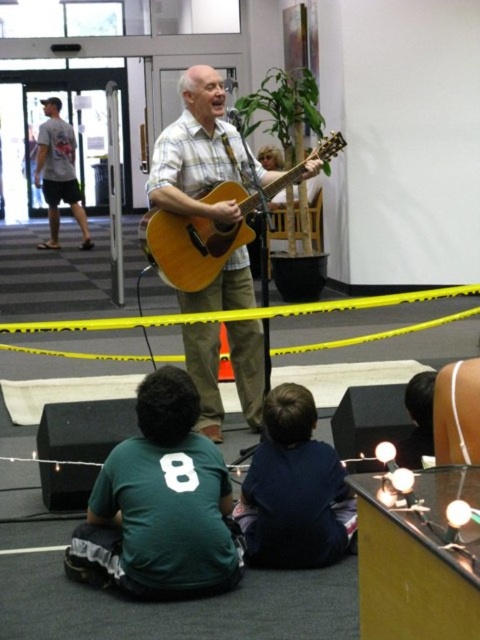
Is wooden acoustic guitar at center taller than dark blue shirt at lower center?

Yes.

Does wooden acoustic guitar at center lie in front of dark blue shirt at lower center?

No.

Does point (176, 129) come farther from viewer compared to point (286, 552)?

Yes, it is behind point (286, 552).

Find the location of a particular element. This screenshot has height=640, width=480. wooden acoustic guitar at center is located at coordinates (197, 150).

Can you confirm if green jersey at lower left is positioned to the left of wooden acoustic guitar at center?

Correct, you'll find green jersey at lower left to the left of wooden acoustic guitar at center.

What do you see at coordinates (159, 504) in the screenshot? I see `green jersey at lower left` at bounding box center [159, 504].

The height and width of the screenshot is (640, 480). I want to click on green jersey at lower left, so click(x=159, y=504).

Locate an element on the screen. This screenshot has width=480, height=640. green jersey at lower left is located at coordinates (159, 504).

Between wooden acoustic guitar at center and light brown acoustic guitar at center, which one has less height?

With less height is wooden acoustic guitar at center.

Is point (224, 305) behind point (250, 225)?

Yes, point (224, 305) is farther from viewer.

Between point (237, 276) and point (168, 276), which one is positioned behind?

The point (237, 276) is behind.

This screenshot has width=480, height=640. I want to click on wooden acoustic guitar at center, so click(197, 150).